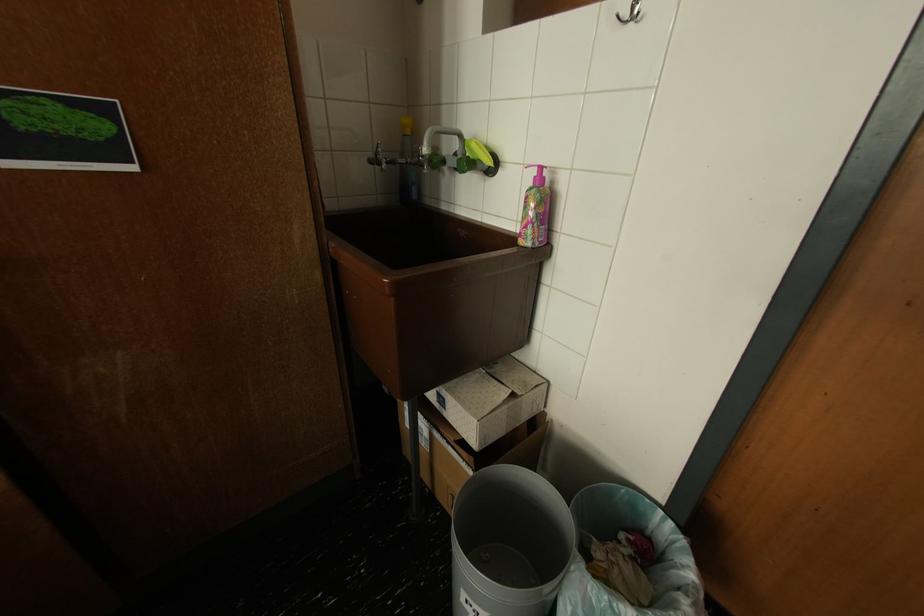
Where would you lift the pink soap bottle? Please return your answer as a coordinate pair (x, y).

(535, 211)